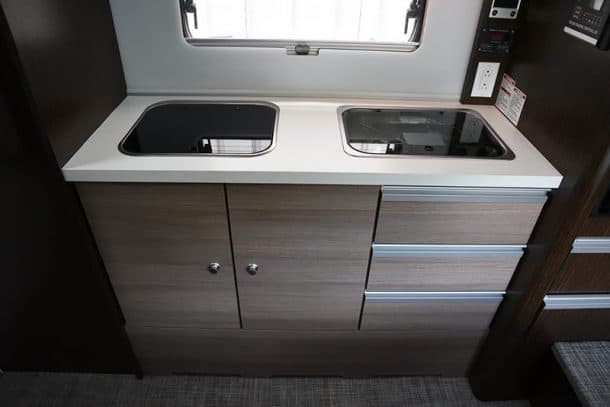
This screenshot has width=610, height=407. Identify the location of sink. (220, 137).